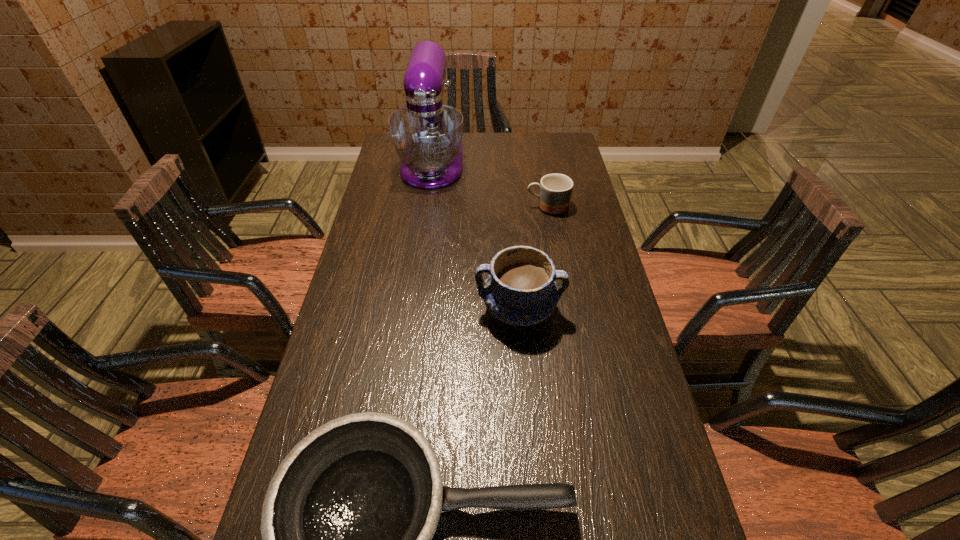
The height and width of the screenshot is (540, 960). I want to click on free space located on the side with the handle of the mug, so 496,207.

Identify the location of object at the far edge. (427, 135).

Find the location of a particular element. Image resolution: width=960 pixels, height=540 pixels. object at the left edge is located at coordinates (427, 135).

The height and width of the screenshot is (540, 960). I want to click on pottery that is at the right edge, so click(520, 290).

Locate an element on the screen. This screenshot has height=540, width=960. mug that is at the right edge is located at coordinates pyautogui.click(x=555, y=189).

The image size is (960, 540). Find the location of `object that is positioned at the far left corner`. object that is positioned at the far left corner is located at coordinates (427, 135).

The height and width of the screenshot is (540, 960). In order to click on vacant space at the far edge of the desktop in this screenshot , I will do `click(475, 146)`.

I want to click on vacant space at the left edge, so click(343, 332).

Locate an element on the screen. vacant space at the right edge of the desktop is located at coordinates pyautogui.click(x=630, y=449).

Where is `free spot at the far left corner of the desktop`? Image resolution: width=960 pixels, height=540 pixels. free spot at the far left corner of the desktop is located at coordinates (389, 156).